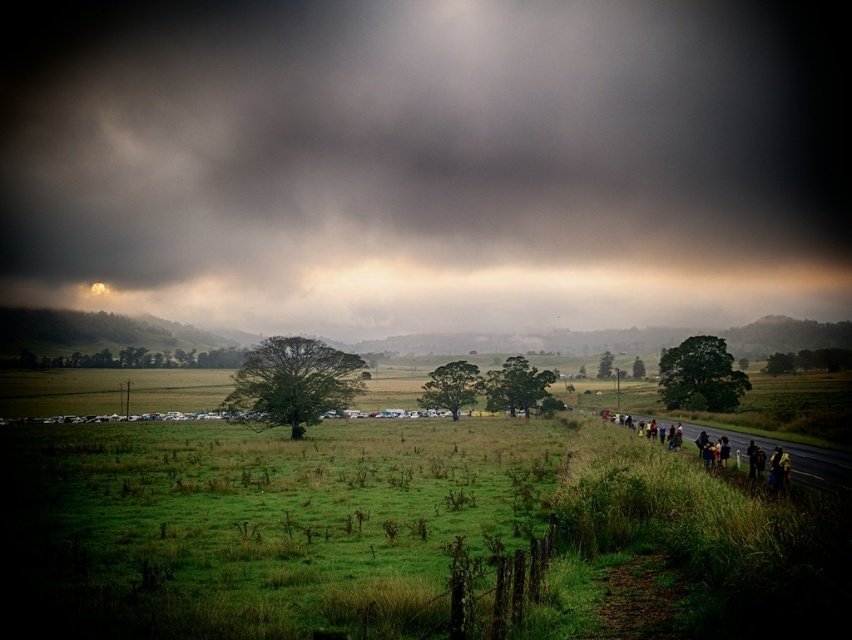
Question: Among these objects, which one is farthest from the camera?

Choices:
 (A) yellow fabric people at lower right
 (B) dark gray cloud at upper center

Answer: (B)

Question: In this image, where is dark gray cloud at upper center located relative to yellow fabric people at lower right?

Choices:
 (A) left
 (B) right

Answer: (A)

Question: Can you confirm if dark gray cloud at upper center is positioned to the right of yellow fabric people at lower right?

Choices:
 (A) no
 (B) yes

Answer: (A)

Question: Which of the following is the farthest from the observer?

Choices:
 (A) (242, 298)
 (B) (756, 470)

Answer: (A)

Question: Does dark gray cloud at upper center have a lesser width compared to yellow fabric people at lower right?

Choices:
 (A) yes
 (B) no

Answer: (B)